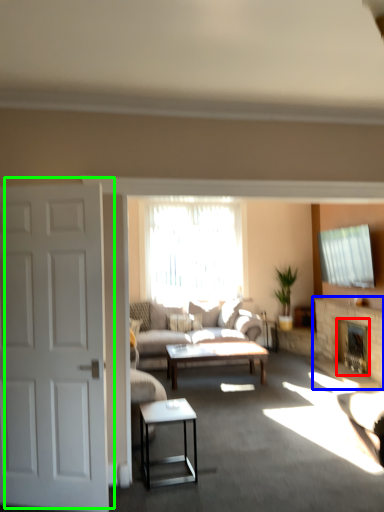
Question: Considering the real-world distances, which object is farthest from fireplace (highlighted by a red box)? fireplace (highlighted by a blue box) or door (highlighted by a green box)?

Choices:
 (A) fireplace
 (B) door

Answer: (B)